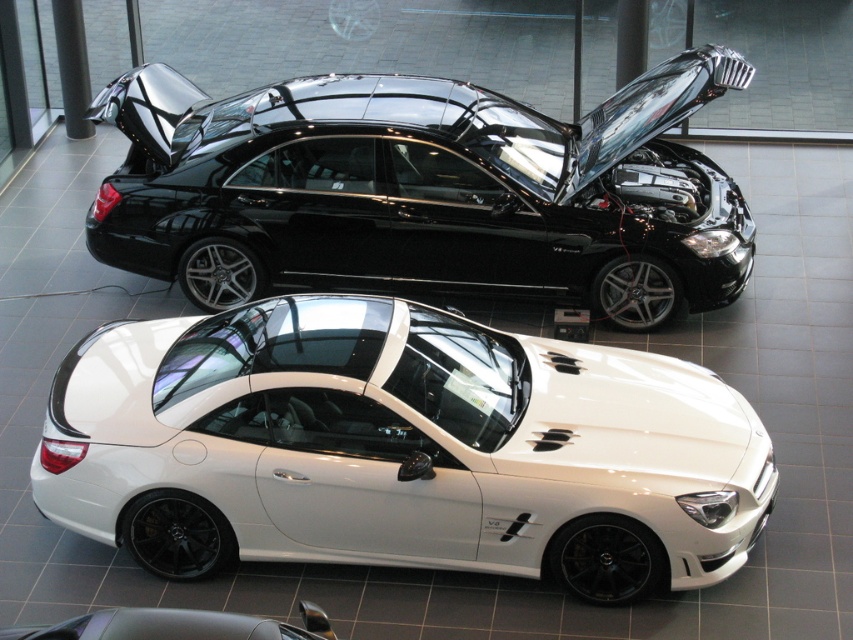
Question: Can you confirm if white glossy sedan at center is thinner than black metallic sedan at center?

Choices:
 (A) yes
 (B) no

Answer: (A)

Question: Which point is closer to the camera?

Choices:
 (A) black metallic sedan at center
 (B) white glossy sedan at center

Answer: (B)

Question: Which of the following is the closest to the observer?

Choices:
 (A) (223, 106)
 (B) (206, 454)

Answer: (B)

Question: Can you confirm if white glossy sedan at center is smaller than black metallic sedan at center?

Choices:
 (A) yes
 (B) no

Answer: (A)

Question: Which point is closer to the camera?

Choices:
 (A) black metallic sedan at center
 (B) white glossy sedan at center

Answer: (B)

Question: Can you confirm if white glossy sedan at center is positioned above black metallic sedan at center?

Choices:
 (A) no
 (B) yes

Answer: (A)